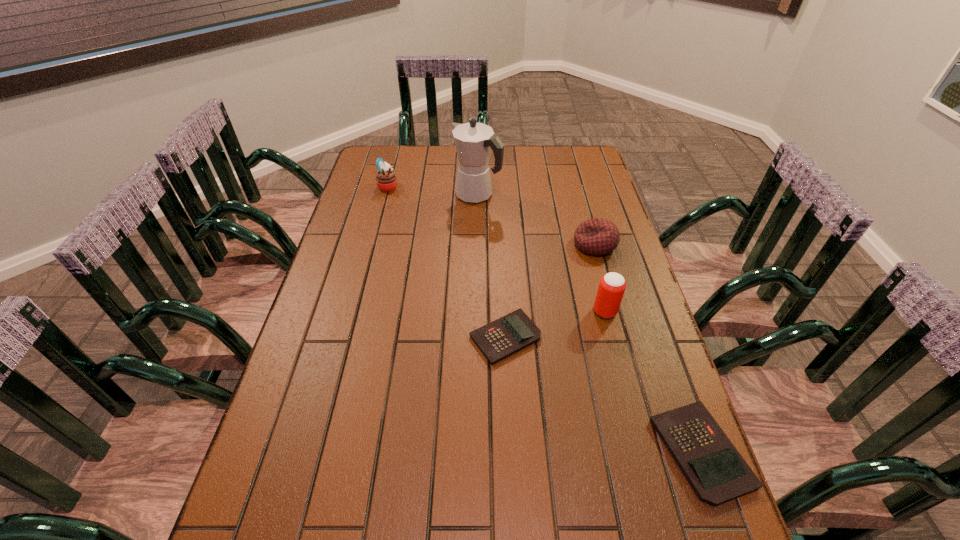
This screenshot has height=540, width=960. In order to click on vacant space that satisfies the following two spatial constraints: 1. on the front side of the taller calculator; 2. on the right side of the fourth nearest object in this screenshot , I will do `click(653, 452)`.

Where is `vacant area that satisfies the following two spatial constraints: 1. on the front-facing side of the leftmost object; 2. on the back side of the right calculator`? Image resolution: width=960 pixels, height=540 pixels. vacant area that satisfies the following two spatial constraints: 1. on the front-facing side of the leftmost object; 2. on the back side of the right calculator is located at coordinates (318, 452).

You are a GUI agent. You are given a task and a screenshot of the screen. Output one action in this format:
    pyautogui.click(x=<x>, y=<y>)
    Task: Click on the free space that satisfies the following two spatial constraints: 1. on the back side of the beer can; 2. on the front-facing side of the leftmost object
    This screenshot has height=540, width=960.
    Given the screenshot: What is the action you would take?
    pyautogui.click(x=572, y=186)

Where is `vacant point that satisfies the following two spatial constraints: 1. on the front side of the coffeepot; 2. on the left side of the beer can`? This screenshot has width=960, height=540. vacant point that satisfies the following two spatial constraints: 1. on the front side of the coffeepot; 2. on the left side of the beer can is located at coordinates (476, 312).

You are a GUI agent. You are given a task and a screenshot of the screen. Output one action in this format:
    pyautogui.click(x=<x>, y=<y>)
    Task: Click on the free space that satisfies the following two spatial constraints: 1. on the front-facing side of the muffin; 2. on the back side of the beer can
    Image resolution: width=960 pixels, height=540 pixels.
    Given the screenshot: What is the action you would take?
    pyautogui.click(x=355, y=312)

Identify the location of vacant region that satisfies the following two spatial constraints: 1. on the front-facing side of the beer can; 2. on the left side of the leftmost object. (355, 312).